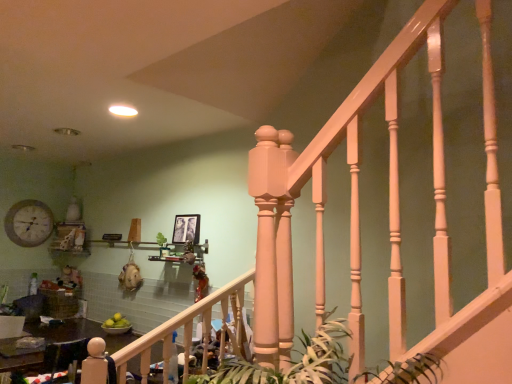
Question: Is matte white clock at upper left behind wooden table at lower left?

Choices:
 (A) yes
 (B) no

Answer: (A)

Question: Considering the relative positions of matte white clock at upper left and wooden table at lower left in the image provided, is matte white clock at upper left to the right of wooden table at lower left from the viewer's perspective?

Choices:
 (A) yes
 (B) no

Answer: (B)

Question: Can you confirm if matte white clock at upper left is positioned to the left of wooden table at lower left?

Choices:
 (A) no
 (B) yes

Answer: (B)

Question: Considering the relative sizes of matte white clock at upper left and wooden table at lower left in the image provided, is matte white clock at upper left smaller than wooden table at lower left?

Choices:
 (A) no
 (B) yes

Answer: (B)

Question: Is matte white clock at upper left shorter than wooden table at lower left?

Choices:
 (A) no
 (B) yes

Answer: (A)

Question: From a real-world perspective, does matte white clock at upper left stand above wooden table at lower left?

Choices:
 (A) yes
 (B) no

Answer: (A)

Question: Is wooden table at lower left directly adjacent to matte white railing at center?

Choices:
 (A) yes
 (B) no

Answer: (B)

Question: Is wooden table at lower left oriented away from matte white railing at center?

Choices:
 (A) yes
 (B) no

Answer: (A)

Question: Is wooden table at lower left outside of matte white railing at center?

Choices:
 (A) yes
 (B) no

Answer: (A)

Question: Considering the relative positions of wooden table at lower left and matte white railing at center in the image provided, is wooden table at lower left to the left of matte white railing at center from the viewer's perspective?

Choices:
 (A) no
 (B) yes

Answer: (B)

Question: Considering the relative sizes of wooden table at lower left and matte white railing at center in the image provided, is wooden table at lower left bigger than matte white railing at center?

Choices:
 (A) yes
 (B) no

Answer: (B)

Question: Is wooden table at lower left thinner than matte white railing at center?

Choices:
 (A) no
 (B) yes

Answer: (A)

Question: Is green leafy plant at center looking in the opposite direction of black matte picture frame at upper center?

Choices:
 (A) no
 (B) yes

Answer: (A)